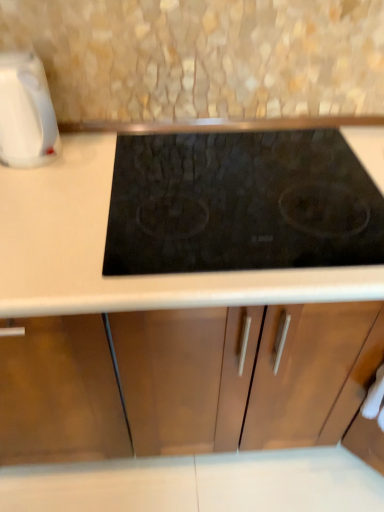
At what (x,y) coordinates should I click in order to perform the action: click on blank space situated above white glossy kettle at left (from a real-world perspective). Please return your answer as a coordinate pair (x, y). The width and height of the screenshot is (384, 512). Looking at the image, I should click on (13, 56).